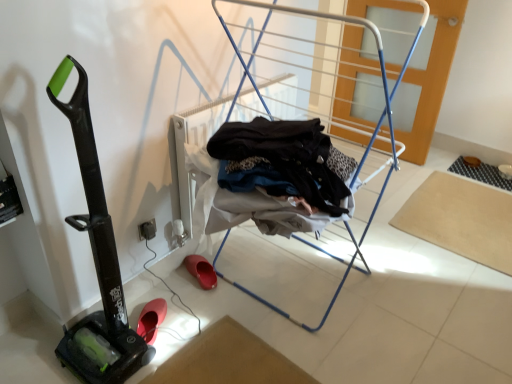
The image size is (512, 384). In order to click on vacant space in between rubber/soft sole shoe at lower left, which is the first footwear from left to right, and metallic blue drying rack at center in this screenshot , I will do `click(206, 316)`.